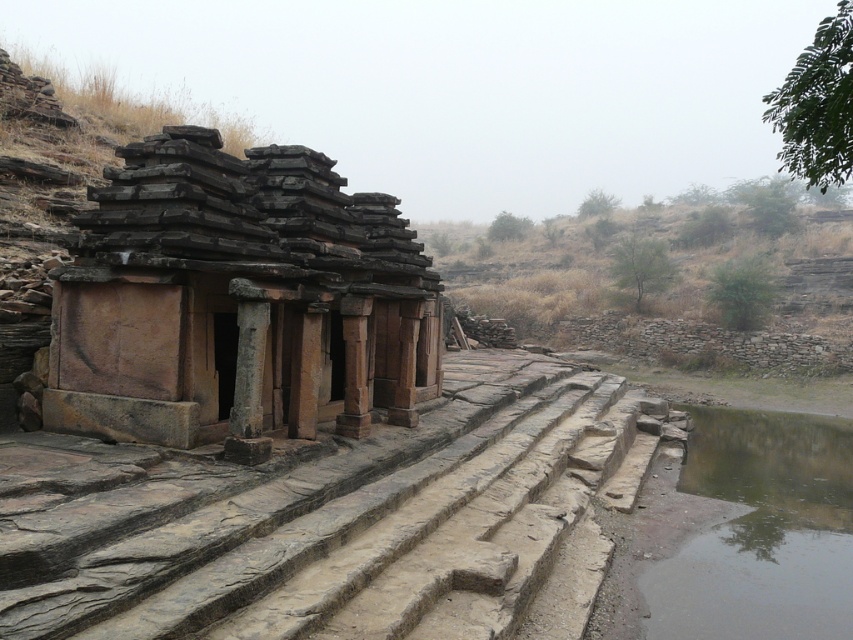
Does rustic stone ruins at center appear under greenish murky water at bottom right?

Actually, rustic stone ruins at center is above greenish murky water at bottom right.

Which is behind, point (360, 224) or point (688, 557)?

Positioned behind is point (360, 224).

This screenshot has height=640, width=853. What are the coordinates of `rustic stone ruins at center` in the screenshot? It's located at (236, 300).

Does rustic stone stairs at center have a greater height compared to rustic stone ruins at center?

Correct, rustic stone stairs at center is much taller as rustic stone ruins at center.

Does point (109, 612) come farther from viewer compared to point (90, 218)?

No, it is in front of (90, 218).

You are a GUI agent. You are given a task and a screenshot of the screen. Output one action in this format:
    pyautogui.click(x=<x>, y=<y>)
    Task: Click on the rustic stone stairs at center
    This screenshot has height=640, width=853.
    Given the screenshot: What is the action you would take?
    pyautogui.click(x=329, y=520)

Is rustic stone stairs at center bigger than greenish murky water at bottom right?

Correct, rustic stone stairs at center is larger in size than greenish murky water at bottom right.

Is the position of rustic stone stairs at center more distant than that of greenish murky water at bottom right?

No, rustic stone stairs at center is closer to the viewer.

Between point (630, 435) and point (801, 525), which one is positioned behind?

Point (630, 435)

Image resolution: width=853 pixels, height=640 pixels. In order to click on rustic stone stairs at center in this screenshot , I will do `click(329, 520)`.